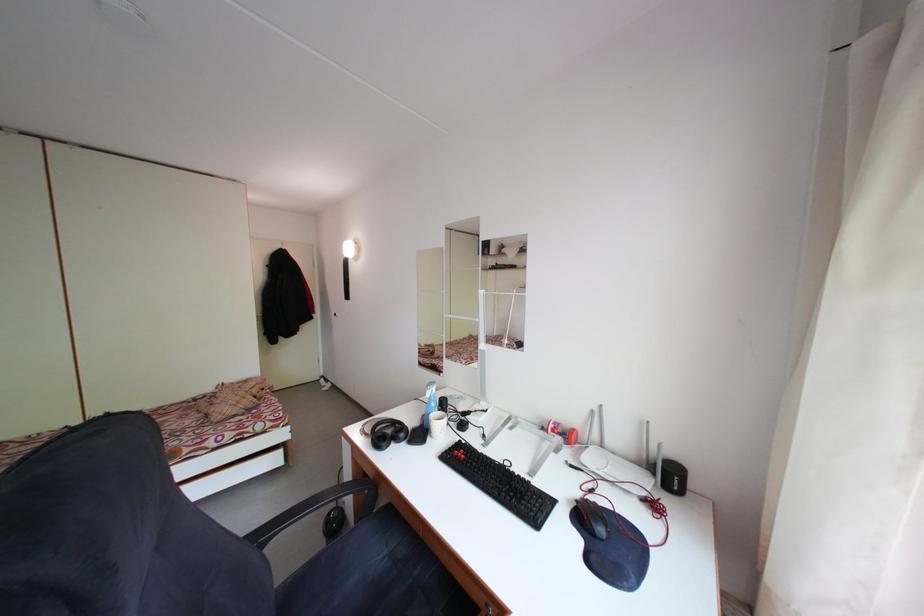
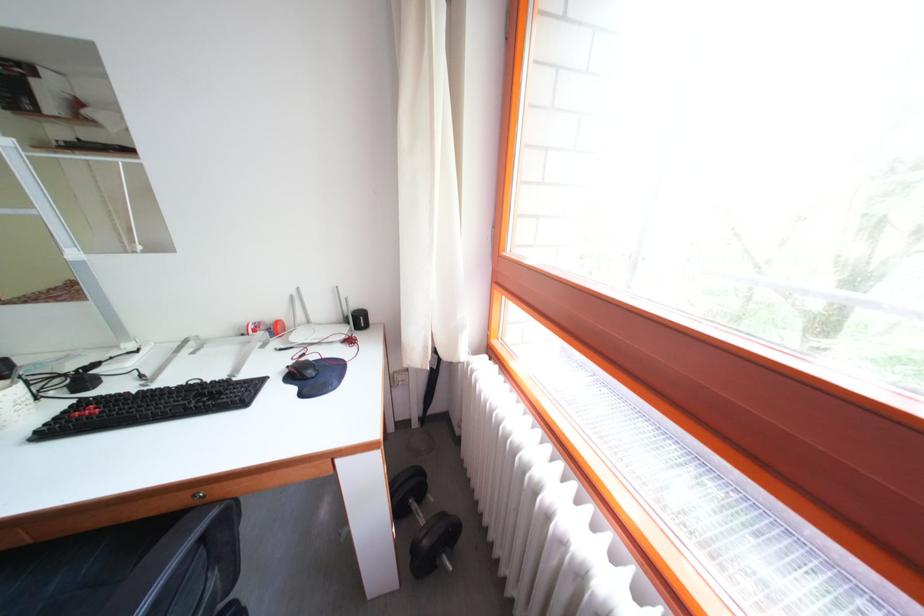
The point at (588, 501) is marked in the first image. Where is the corresponding point in the second image?

(298, 370)